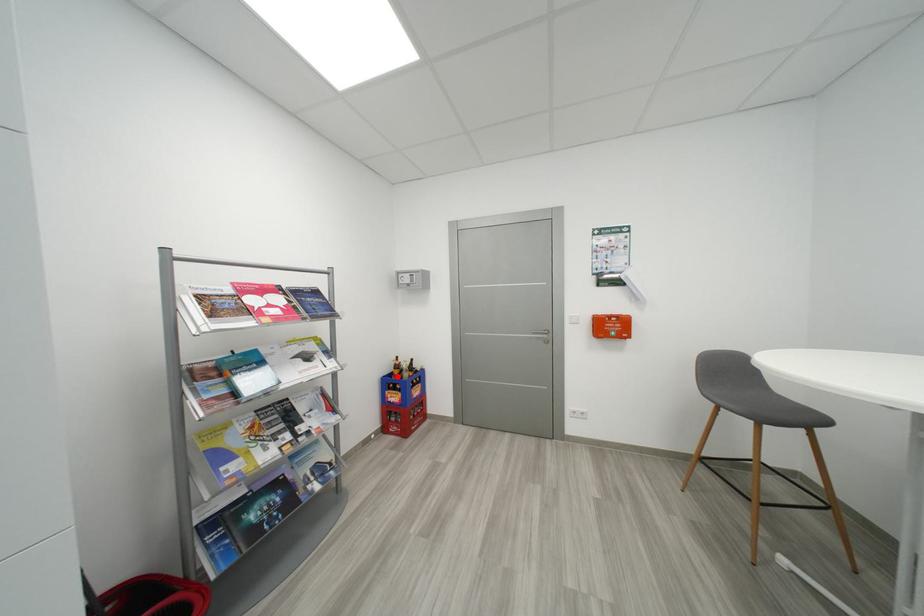
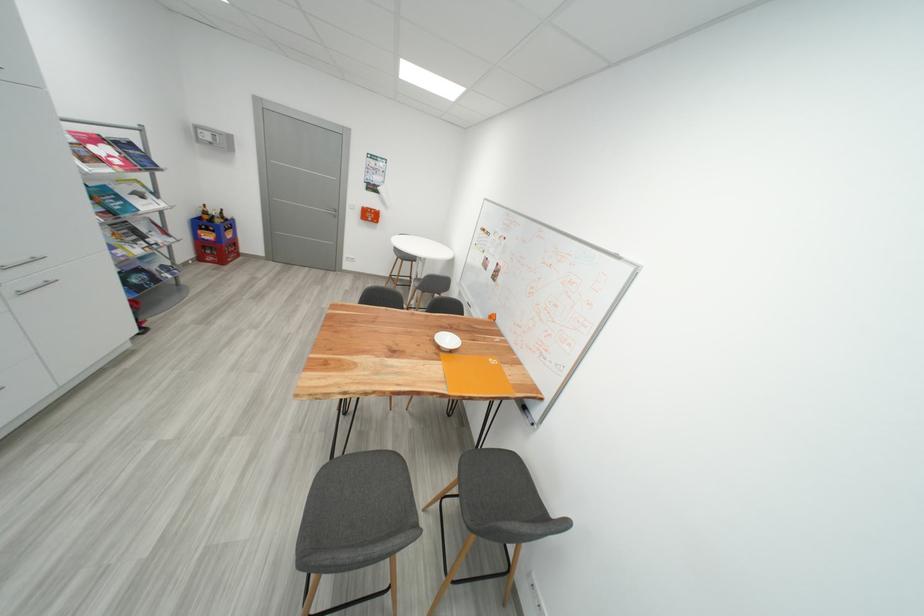
Locate, in the second image, the point that corresponds to the highlighted location in the first image.

(208, 220)